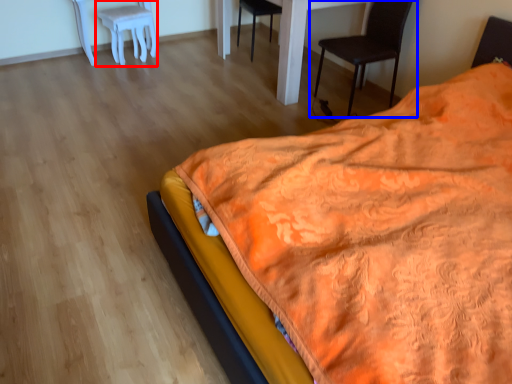
Question: Which point is closer to the camera, stool (highlighted by a red box) or chair (highlighted by a blue box)?

Choices:
 (A) stool
 (B) chair

Answer: (B)